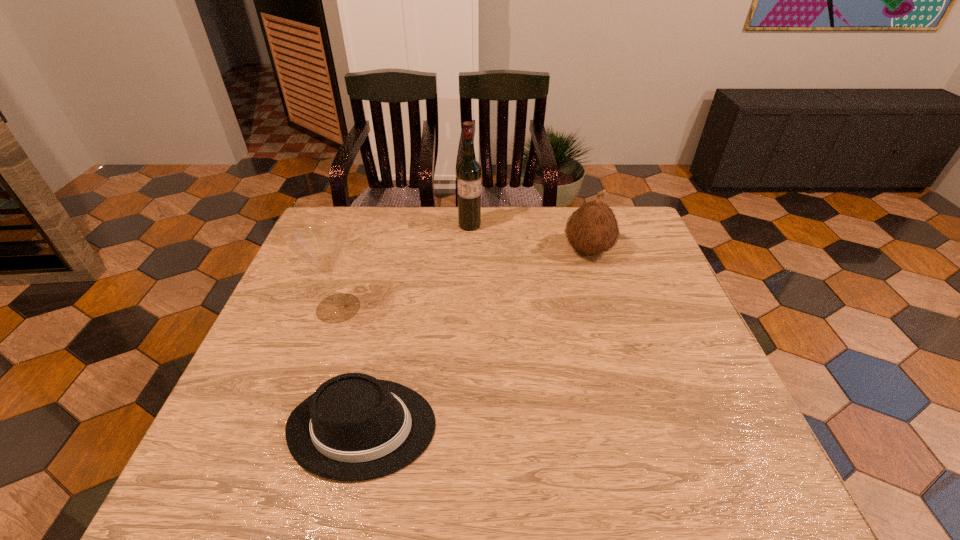
Find the location of `object present at the far right corner`. object present at the far right corner is located at coordinates (592, 229).

What are the coordinates of `vacant area at the far edge` in the screenshot? It's located at (425, 249).

Where is `vacant area at the near edge`? This screenshot has height=540, width=960. vacant area at the near edge is located at coordinates (657, 491).

In the image, there is a desktop. At what (x,y) coordinates should I click in order to perform the action: click on vacant space at the left edge. Please return your answer as a coordinate pair (x, y). Image resolution: width=960 pixels, height=540 pixels. Looking at the image, I should click on (317, 321).

In the image, there is a desktop. At what (x,y) coordinates should I click in order to perform the action: click on free space at the right edge. Please return your answer as a coordinate pair (x, y). Looking at the image, I should click on (653, 287).

Identify the location of vacant space at the far left corner of the desktop. This screenshot has width=960, height=540. (328, 210).

You are a GUI agent. You are given a task and a screenshot of the screen. Output one action in this format:
    pyautogui.click(x=<x>, y=<y>)
    Task: Click on the free space at the near left corner of the desktop
    This screenshot has height=540, width=960.
    Given the screenshot: What is the action you would take?
    pyautogui.click(x=259, y=456)

Image resolution: width=960 pixels, height=540 pixels. Find the location of `vacant space at the far right corner of the desktop`. vacant space at the far right corner of the desktop is located at coordinates (655, 245).

Find the location of `unoccupied area between the nearest object and the wine bottle`. unoccupied area between the nearest object and the wine bottle is located at coordinates (417, 326).

Identify the location of free space between the coconut and the tallest object. Image resolution: width=960 pixels, height=540 pixels. (529, 238).